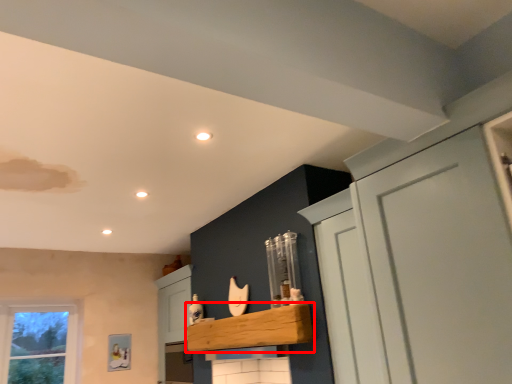
Question: From the image's perspective, where is cabinetry (annotated by the red box) located relative to cupboard?

Choices:
 (A) above
 (B) below

Answer: (B)